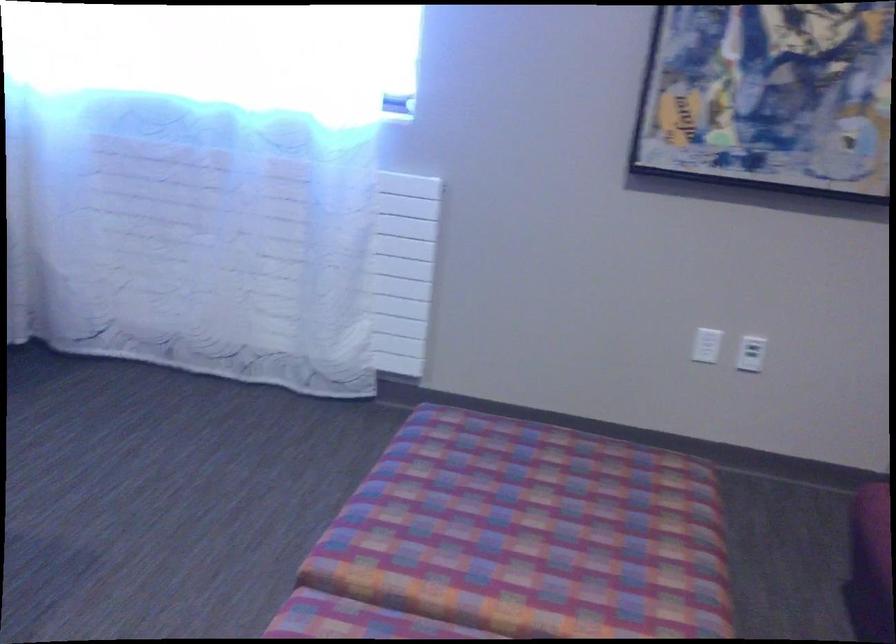
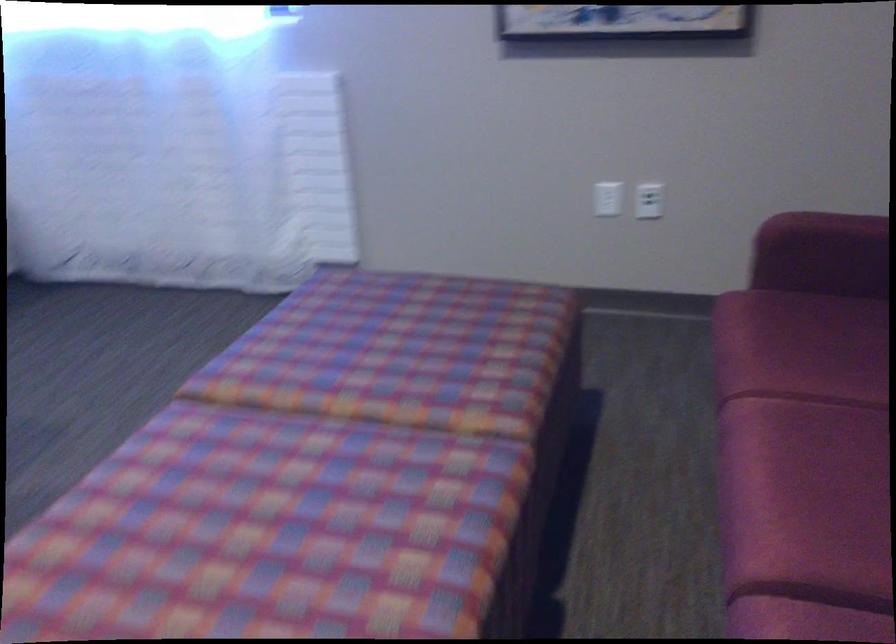
Question: The images are taken continuously from a first-person perspective. In which direction is your viewpoint rotating?

Choices:
 (A) Left
 (B) Right
 (C) Up
 (D) Down

Answer: (D)